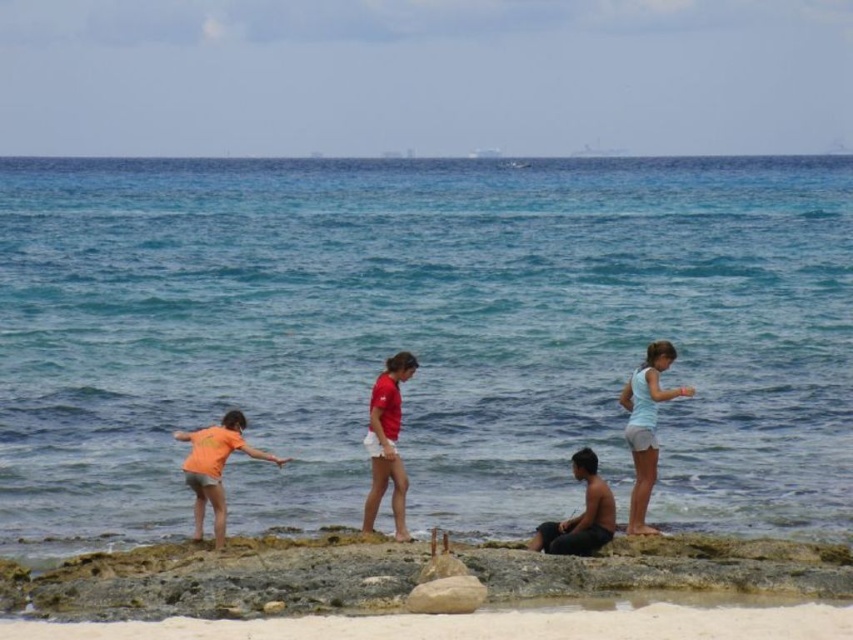
You are a lifeguard on duty at the beach. You need to locate the person wearing the matte red shirt at center. According to the coordinates provided, where should you look to find them?

The matte red shirt at center is located at coordinates point (387, 442).

You are a photographer standing at the center of the beach scene. You want to take a photo that includes both the point at (376, 390) and the point at (606, 538). Which point should you focus on first to ensure both are in sharp focus?

You should focus on the point at (376, 390) first because it is closer to the camera than the point at (606, 538). By focusing on the closer point, the farther point will also be within the depth of field and in focus.

You are standing at the center of the beach and want to reach the clear blue water at center. Which direction should you move in to get there?

Since you are already at the center of the beach, the clear blue water at center is directly in front of you, so you should move straight ahead.